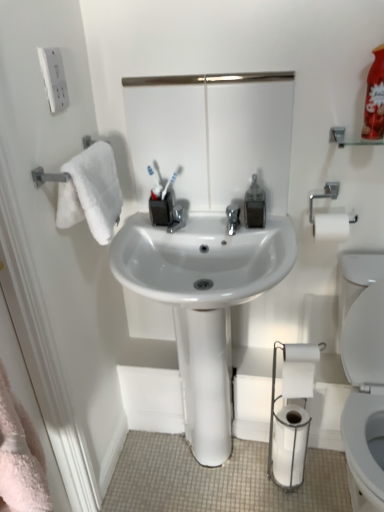
Question: Does clear plastic soap dispenser at center appear on the right side of white matte toilet paper at lower right, the 1th toilet paper positioned from the bottom?

Choices:
 (A) yes
 (B) no

Answer: (B)

Question: Is clear plastic soap dispenser at center far away from white matte toilet paper at lower right, the 2th toilet paper from the top?

Choices:
 (A) no
 (B) yes

Answer: (A)

Question: Is clear plastic soap dispenser at center shorter than white matte toilet paper at lower right, the 1th toilet paper positioned from the bottom?

Choices:
 (A) yes
 (B) no

Answer: (A)

Question: Is clear plastic soap dispenser at center at the left side of white matte toilet paper at lower right, the 2th toilet paper from the top?

Choices:
 (A) no
 (B) yes

Answer: (B)

Question: Does clear plastic soap dispenser at center have a greater height compared to white matte toilet paper at lower right, the 1th toilet paper positioned from the bottom?

Choices:
 (A) no
 (B) yes

Answer: (A)

Question: From the image's perspective, is clear plastic soap dispenser at center on white matte toilet paper at lower right, the 2th toilet paper from the top?

Choices:
 (A) no
 (B) yes

Answer: (B)

Question: Is white matte toilet paper at lower right, the 2th toilet paper from the top, at the back of white glossy sink at center?

Choices:
 (A) no
 (B) yes

Answer: (A)

Question: From the image's perspective, is white glossy sink at center above white matte toilet paper at lower right, the 2th toilet paper from the top?

Choices:
 (A) no
 (B) yes

Answer: (B)

Question: Considering the relative sizes of white glossy sink at center and white matte toilet paper at lower right, the 1th toilet paper positioned from the bottom, in the image provided, is white glossy sink at center taller than white matte toilet paper at lower right, the 1th toilet paper positioned from the bottom,?

Choices:
 (A) no
 (B) yes

Answer: (B)

Question: Is white glossy sink at center at the right side of white matte toilet paper at lower right, the 1th toilet paper positioned from the bottom?

Choices:
 (A) no
 (B) yes

Answer: (A)

Question: Can you confirm if white glossy sink at center is wider than white matte toilet paper at lower right, the 1th toilet paper positioned from the bottom?

Choices:
 (A) yes
 (B) no

Answer: (A)

Question: Considering the relative sizes of white glossy sink at center and white matte toilet paper at lower right, the 1th toilet paper positioned from the bottom, in the image provided, is white glossy sink at center bigger than white matte toilet paper at lower right, the 1th toilet paper positioned from the bottom,?

Choices:
 (A) no
 (B) yes

Answer: (B)

Question: Is white glossy sink at center with white matte toilet paper at lower right, the 2th toilet paper positioned from the bottom?

Choices:
 (A) no
 (B) yes

Answer: (A)